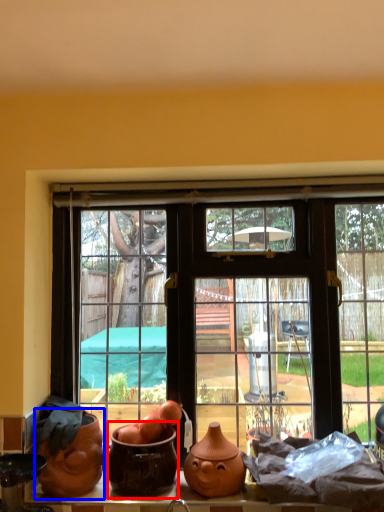
Question: Which point is closer to the camera, pottery (highlighted by a red box) or pottery (highlighted by a blue box)?

Choices:
 (A) pottery
 (B) pottery

Answer: (A)